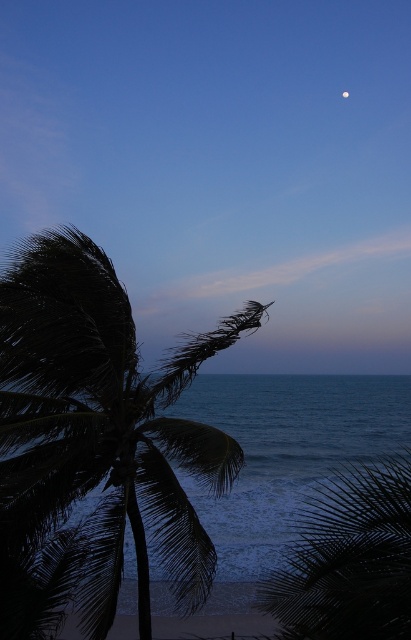
You are standing on the beach looking at the dark green leafy palm at left and the dark green leafy coconut tree at lower right. Which tree is taller?

The dark green leafy palm at left is taller than the dark green leafy coconut tree at lower right.

Based on the coordinates provided, where is the dark green leafy palm at left located in the image?

The dark green leafy palm at left is located at the coordinates point (x=96, y=444).